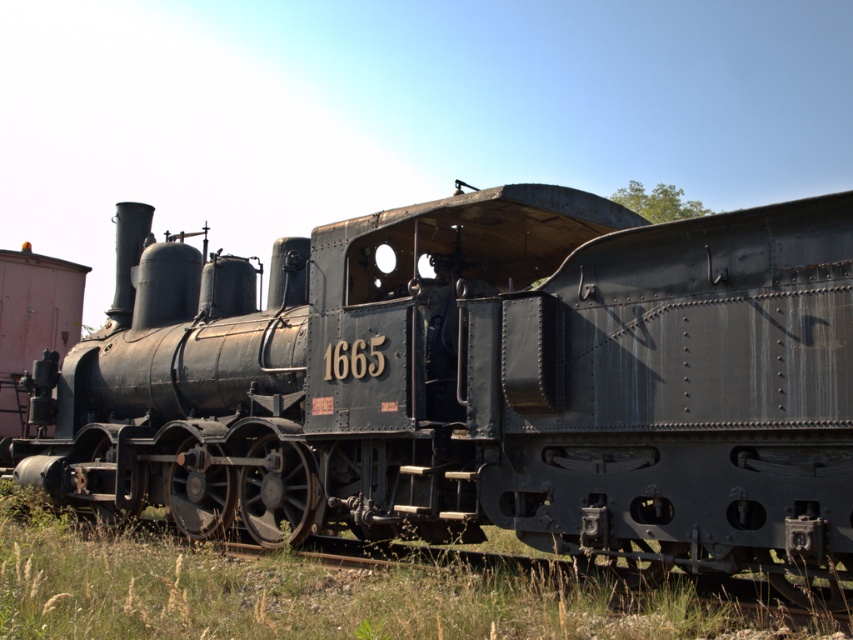
Question: Which point is closer to the camera?

Choices:
 (A) green grass at lower left
 (B) matte black locomotive at center

Answer: (B)

Question: Does matte black locomotive at center have a greater width compared to green grass at lower left?

Choices:
 (A) no
 (B) yes

Answer: (B)

Question: Is matte black locomotive at center smaller than green grass at lower left?

Choices:
 (A) no
 (B) yes

Answer: (A)

Question: Does matte black locomotive at center have a greater width compared to green grass at lower left?

Choices:
 (A) no
 (B) yes

Answer: (B)

Question: Which point is closer to the camera?

Choices:
 (A) green grass at lower left
 (B) matte black locomotive at center

Answer: (B)